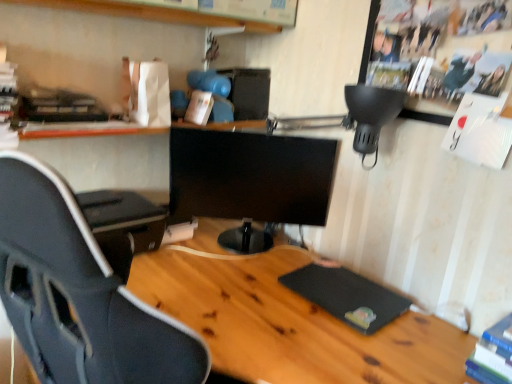
The height and width of the screenshot is (384, 512). What are the coordinates of `free point below black glossy monitor at center (from a real-world perspective)` in the screenshot? It's located at (216, 249).